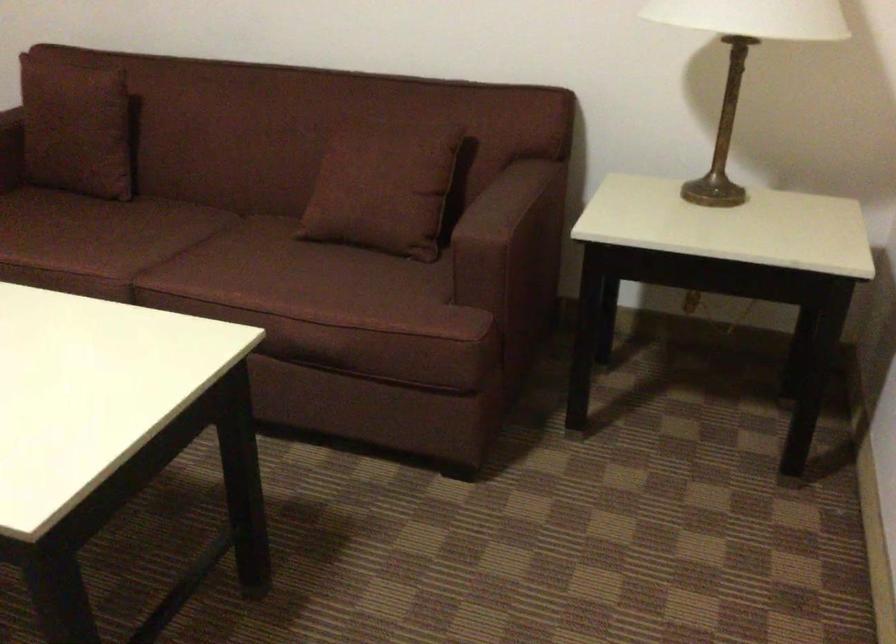
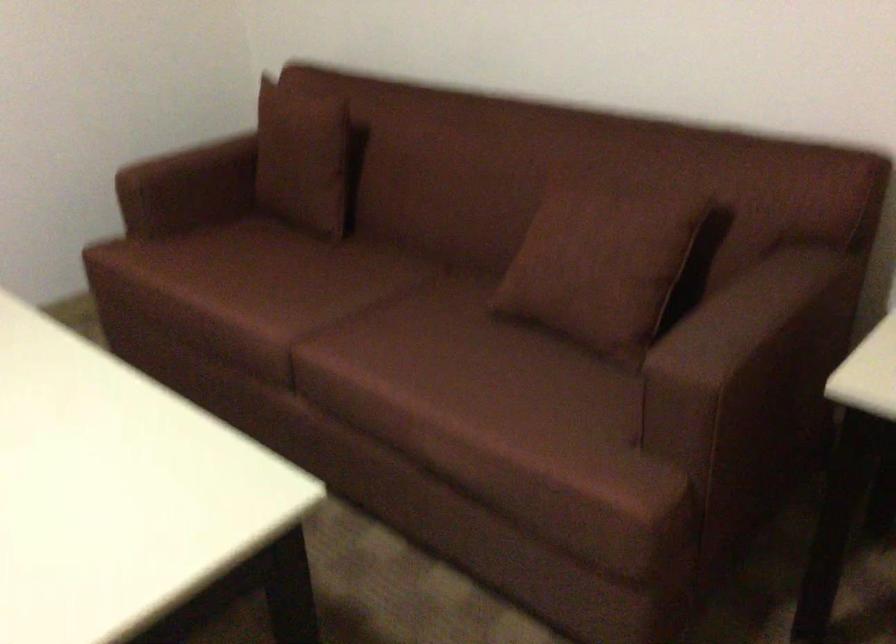
Find the pixel in the second image that matches [540,304] in the first image.

(791, 446)